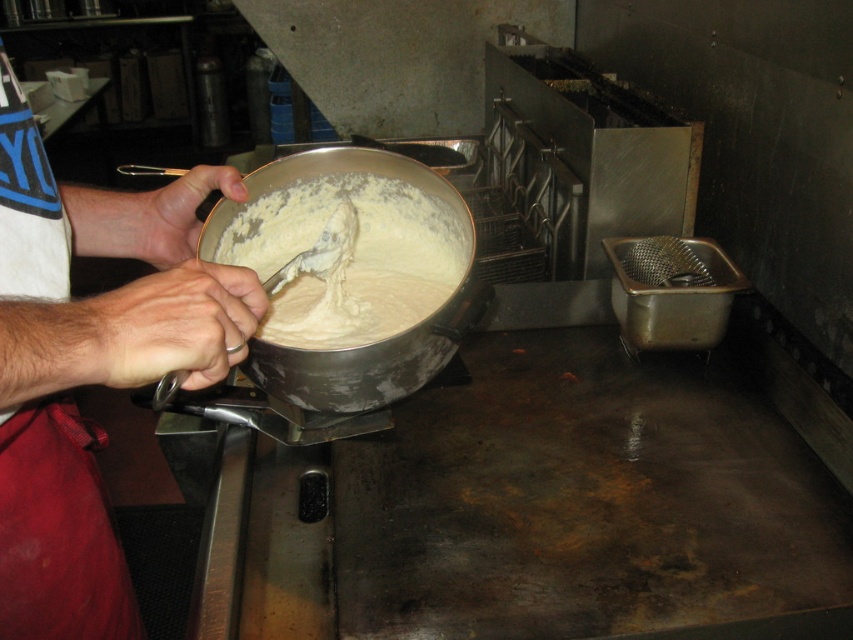
Question: Which point appears farthest from the camera in this image?

Choices:
 (A) (140, 208)
 (B) (125, 589)
 (C) (91, 346)

Answer: (A)

Question: Which of these objects is positioned farthest from the white matte bowl at upper left?

Choices:
 (A) matte silver spoon at upper center
 (B) creamy matte pot at center

Answer: (A)

Question: Can you confirm if creamy matte pot at center is thinner than matte silver spoon at upper center?

Choices:
 (A) no
 (B) yes

Answer: (A)

Question: Where is white matte bowl at upper left located in relation to creamy matte pot at center in the image?

Choices:
 (A) above
 (B) below

Answer: (B)

Question: Which of the following is the closest to the observer?

Choices:
 (A) matte silver spoon at upper center
 (B) smooth skin hand at center
 (C) white matte bowl at upper left

Answer: (C)

Question: Does white matte bowl at upper left have a greater width compared to creamy matte pot at center?

Choices:
 (A) no
 (B) yes

Answer: (B)